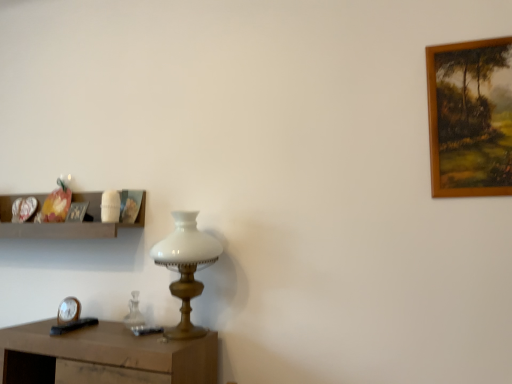
Question: Is brown wooden picture frame at upper right, the 1th picture frame when ordered from top to bottom, aimed at wooden shelf at left?

Choices:
 (A) no
 (B) yes

Answer: (A)

Question: Does brown wooden picture frame at upper right, which is counted as the 2th picture frame, starting from the left, have a larger size compared to wooden shelf at left?

Choices:
 (A) no
 (B) yes

Answer: (A)

Question: Does brown wooden picture frame at upper right, the 1th picture frame in the right-to-left sequence, have a greater width compared to wooden shelf at left?

Choices:
 (A) yes
 (B) no

Answer: (B)

Question: Is brown wooden picture frame at upper right, the 1th picture frame in the right-to-left sequence, facing away from wooden shelf at left?

Choices:
 (A) no
 (B) yes

Answer: (A)

Question: Is brown wooden picture frame at upper right, which is counted as the 2th picture frame, starting from the left, positioned in front of wooden shelf at left?

Choices:
 (A) no
 (B) yes

Answer: (B)

Question: Does brown wooden picture frame at upper right, the 1th picture frame when ordered from top to bottom, have a lesser width compared to wooden shelf at left?

Choices:
 (A) no
 (B) yes

Answer: (B)

Question: Is wooden picture frame at upper left, which ranks as the first picture frame in bottom-to-top order, surrounded by metallic silver clock at lower left?

Choices:
 (A) yes
 (B) no

Answer: (B)

Question: From the image's perspective, is metallic silver clock at lower left below wooden picture frame at upper left, which appears as the 2th picture frame when viewed from the top?

Choices:
 (A) no
 (B) yes

Answer: (B)

Question: From a real-world perspective, is metallic silver clock at lower left under wooden picture frame at upper left, which ranks as the first picture frame in bottom-to-top order?

Choices:
 (A) yes
 (B) no

Answer: (A)

Question: Does metallic silver clock at lower left have a smaller size compared to wooden picture frame at upper left, placed as the 2th picture frame when sorted from front to back?

Choices:
 (A) yes
 (B) no

Answer: (A)

Question: Does metallic silver clock at lower left appear on the left side of wooden picture frame at upper left, the second picture frame when ordered from right to left?

Choices:
 (A) yes
 (B) no

Answer: (A)

Question: Is metallic silver clock at lower left behind wooden picture frame at upper left, which ranks as the first picture frame in bottom-to-top order?

Choices:
 (A) no
 (B) yes

Answer: (A)

Question: Is wooden picture frame at upper left, placed as the 2th picture frame when sorted from front to back, located within wooden shelf at left?

Choices:
 (A) yes
 (B) no

Answer: (A)